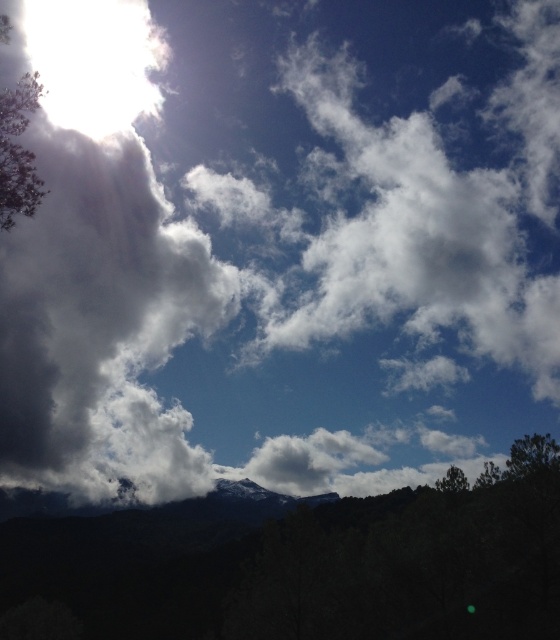
Question: Can you confirm if green leafy tree at upper left is bigger than green matte tree at lower right?

Choices:
 (A) yes
 (B) no

Answer: (A)

Question: Which point is closer to the camera?

Choices:
 (A) green matte tree at lower right
 (B) green leafy tree at upper left

Answer: (B)

Question: Among these points, which one is farthest from the camera?

Choices:
 (A) (24, 99)
 (B) (436, 484)

Answer: (B)

Question: Which object is farther from the camera taking this photo?

Choices:
 (A) green matte tree at lower right
 (B) green leafy tree at upper left

Answer: (A)

Question: Does green leafy tree at upper left have a greater width compared to green matte tree at lower right?

Choices:
 (A) no
 (B) yes

Answer: (B)

Question: Considering the relative positions of green leafy tree at upper left and green matte tree at lower right in the image provided, where is green leafy tree at upper left located with respect to green matte tree at lower right?

Choices:
 (A) above
 (B) below

Answer: (A)